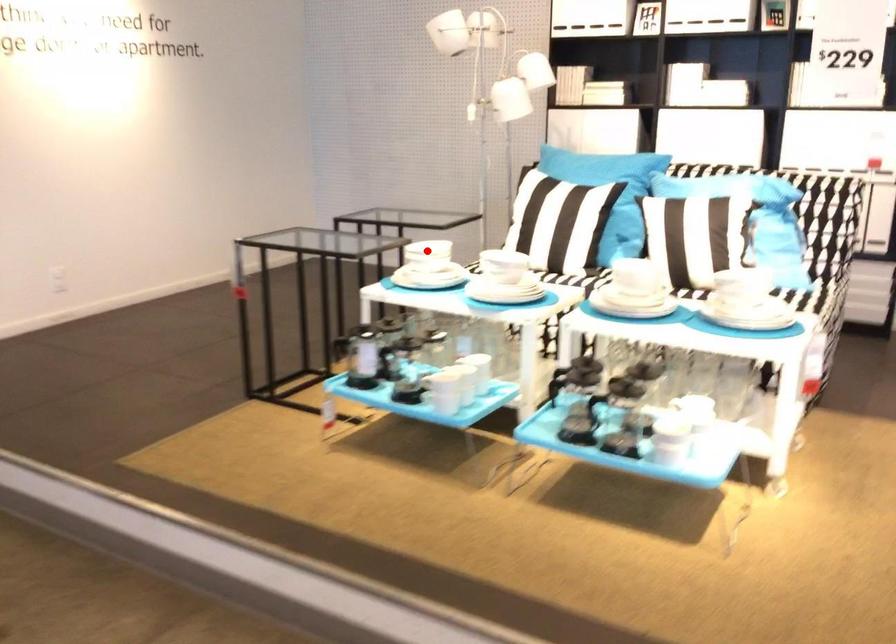
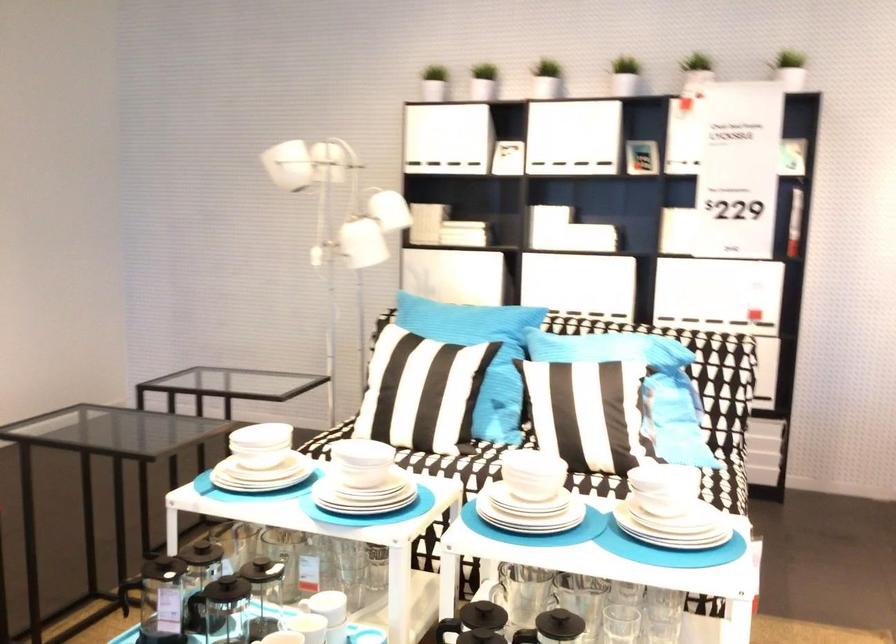
Question: I am providing you with two images of the same scene from different viewpoints. Given a red point in image1, look at the same physical point in image2. Is it:

Choices:
 (A) Closer to the viewpoint
 (B) Farther from the viewpoint

Answer: (A)